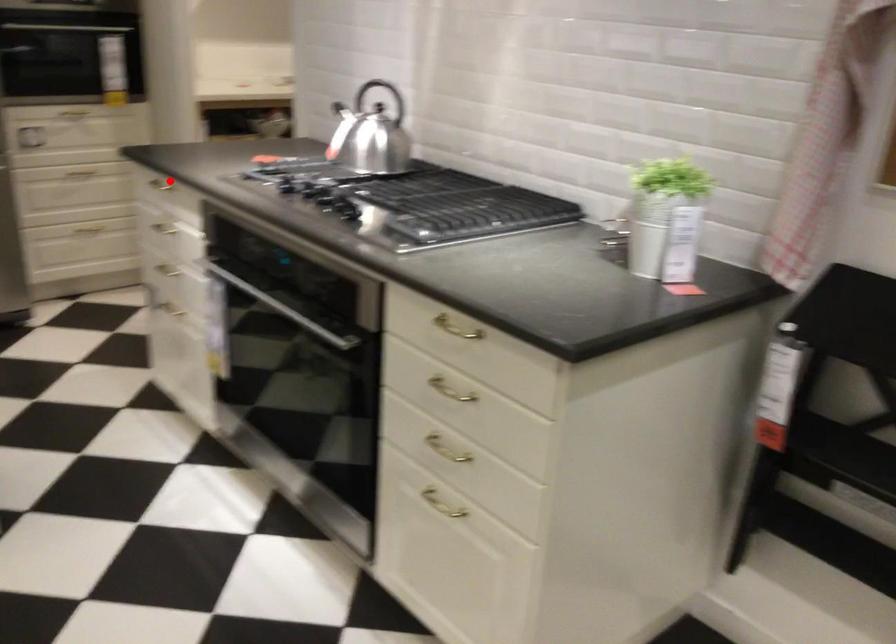
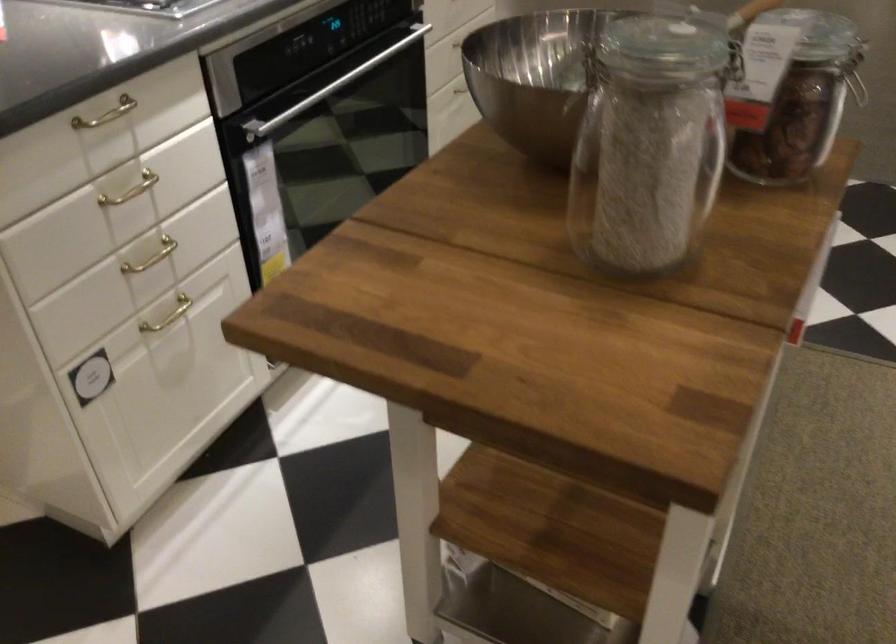
Question: I am providing you with two images of the same scene from different viewpoints. A red point is marked on the first image. Is the red point's position out of view in image 2?

Choices:
 (A) Yes
 (B) No

Answer: (B)